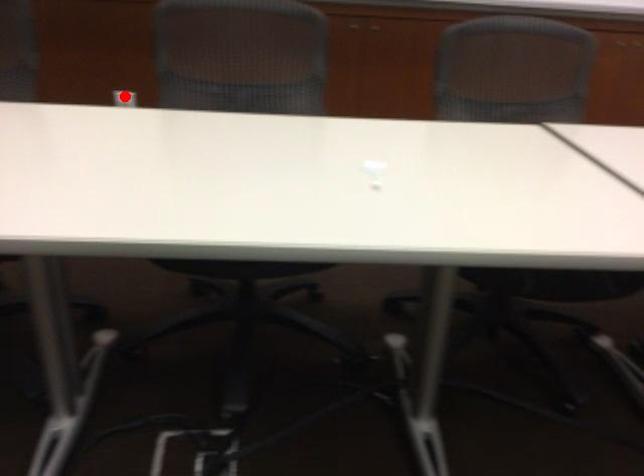
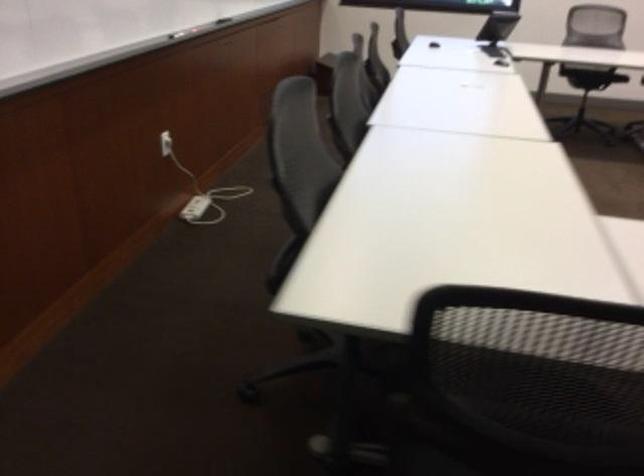
Question: I am providing you with two images of the same scene from different viewpoints. A red point is marked on the first image. At the location where the point appears in image 1, is it still visible in image 2?

Choices:
 (A) Yes
 (B) No

Answer: (B)